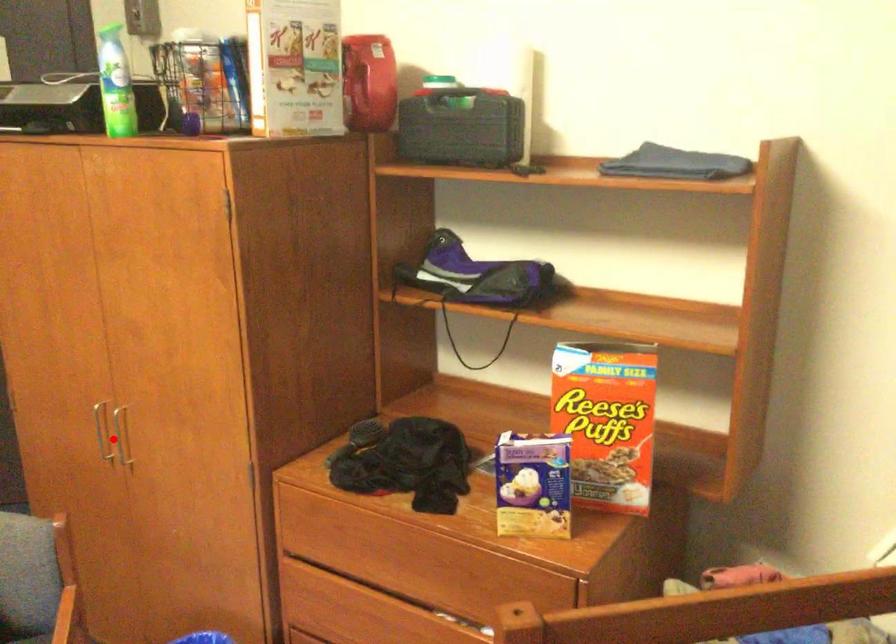
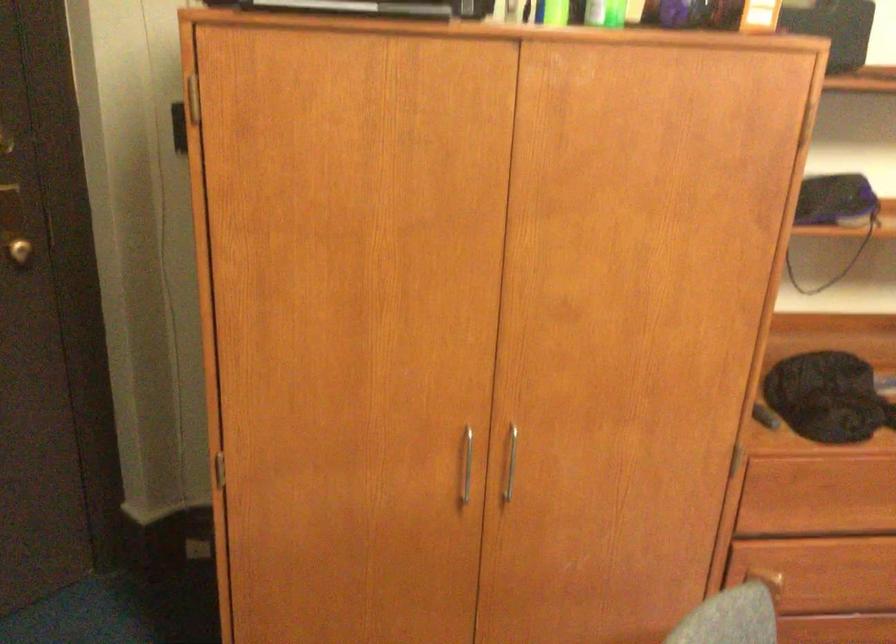
In the second image, find the point that corresponds to the highlighted location in the first image.

(466, 465)